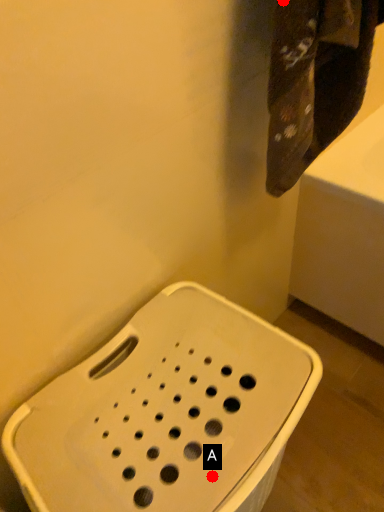
Question: Two points are circled on the image, labeled by A and B beside each circle. Which point is closer to the camera?

Choices:
 (A) A is closer
 (B) B is closer

Answer: (A)